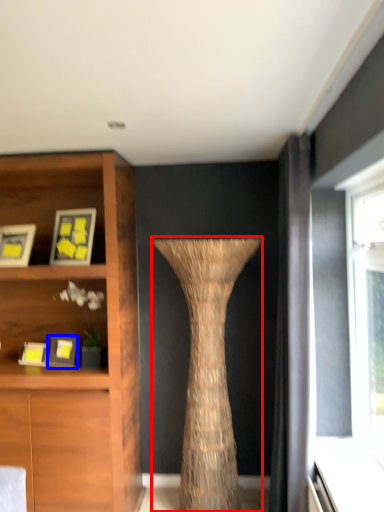
Question: Which object appears farthest to the camera in this image, vase (highlighted by a red box) or picture frame (highlighted by a blue box)?

Choices:
 (A) vase
 (B) picture frame

Answer: (B)